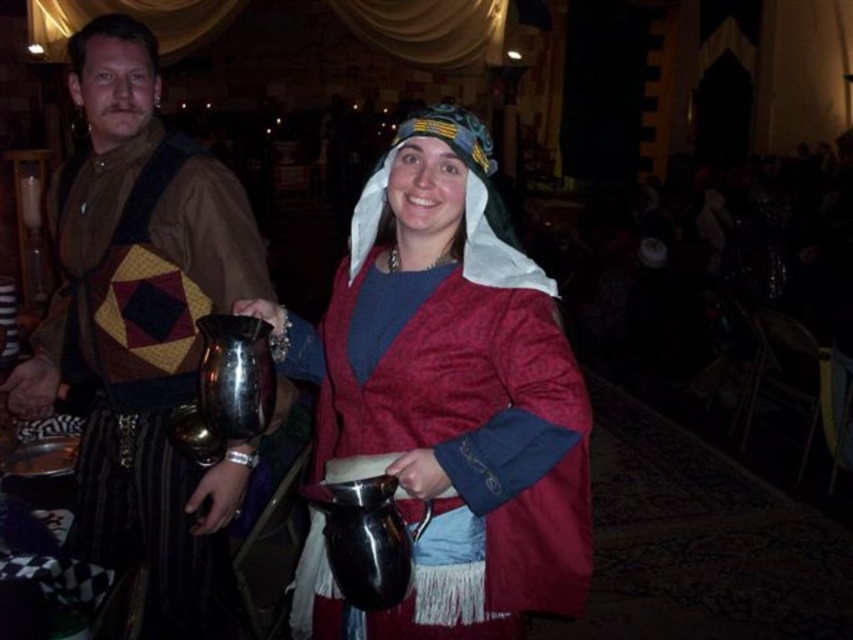
You are a guest at this medieval event and want to pour wine for yourself. You see both the metallic jug at center and the metallic pitcher at center. Which one is taller and thus more likely to have a spout for pouring?

The metallic jug at center is taller than the metallic pitcher at center, so it is more likely to have a spout for pouring.

You are a server at the medieval event and need to pour wine for guests. You have two jugs available. Which jug, the metallic jug at center or the brushed metal jug at left, can hold more liquid based on their sizes?

The brushed metal jug at left can hold more liquid because it is taller than the metallic jug at center.